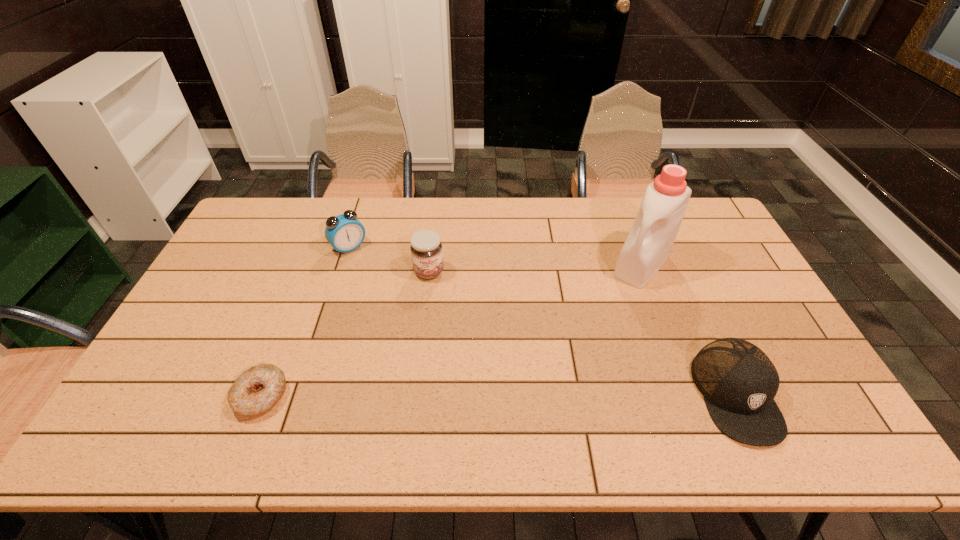
At what (x,y) coordinates should I click in order to perform the action: click on free space on the desktop that is between the doughnut and the cap and is positioned on the front label of the third object from left to right. Please return your answer as a coordinate pair (x, y). Looking at the image, I should click on (472, 395).

Locate an element on the screen. The width and height of the screenshot is (960, 540). free spot on the desktop that is between the doughnut and the cap and is positioned on the face of the alarm clock is located at coordinates (476, 395).

Image resolution: width=960 pixels, height=540 pixels. I want to click on vacant spot on the desktop that is between the doughnut and the cap and is positioned on the handle side of the tallest object, so click(x=534, y=395).